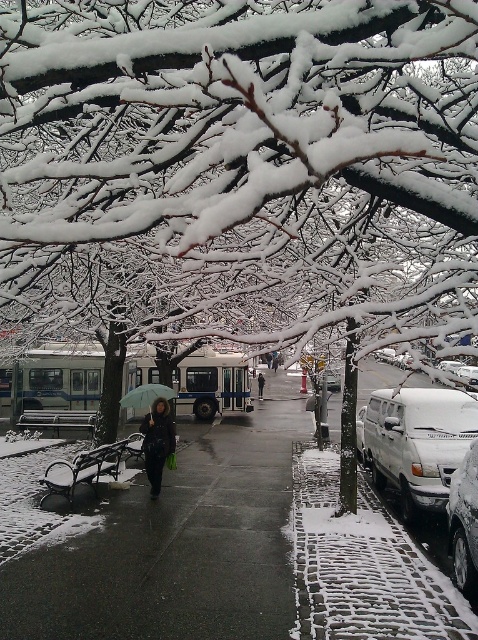
Which of these two, shiny asphalt sidewalk at center or white matte van at lower right, stands shorter?

shiny asphalt sidewalk at center

Who is more distant from viewer, (138,499) or (469,541)?

Positioned behind is point (138,499).

Where is `shiny asphalt sidewalk at center`? The width and height of the screenshot is (478, 640). shiny asphalt sidewalk at center is located at coordinates (177, 547).

Can you confirm if snow-covered branches at upper center is wider than green matte umbrella at center?

In fact, snow-covered branches at upper center might be narrower than green matte umbrella at center.

Is point (41, 17) in front of point (156, 396)?

Yes, it is.

Is point (387, 163) farther from viewer compared to point (170, 396)?

That is False.

Locate an element on the screen. The image size is (478, 640). snow-covered branches at upper center is located at coordinates (242, 163).

Who is higher up, white matte van at lower right or white matte van at center-right?

Positioned higher is white matte van at center-right.

Who is more distant from viewer, [475,477] or [328,387]?

The point [328,387] is more distant.

Locate an element on the screen. The width and height of the screenshot is (478, 640). white matte van at lower right is located at coordinates (464, 522).